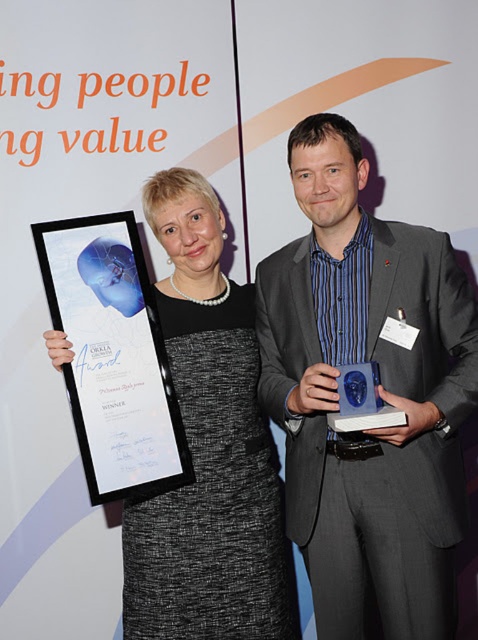
Question: In this image, where is black textured dress at center located relative to black glossy plaque at left?

Choices:
 (A) above
 (B) below

Answer: (B)

Question: Which is nearer to the black textured dress at center?

Choices:
 (A) matte gray suit at center
 (B) black glossy plaque at left

Answer: (B)

Question: Does matte gray suit at center appear on the left side of black glossy plaque at left?

Choices:
 (A) no
 (B) yes

Answer: (A)

Question: Which object is positioned farthest from the matte gray suit at center?

Choices:
 (A) black textured dress at center
 (B) black glossy plaque at left

Answer: (B)

Question: Does black textured dress at center appear on the right side of black glossy plaque at left?

Choices:
 (A) no
 (B) yes

Answer: (B)

Question: Among these objects, which one is farthest from the camera?

Choices:
 (A) matte gray suit at center
 (B) black textured dress at center
 (C) black glossy plaque at left

Answer: (B)